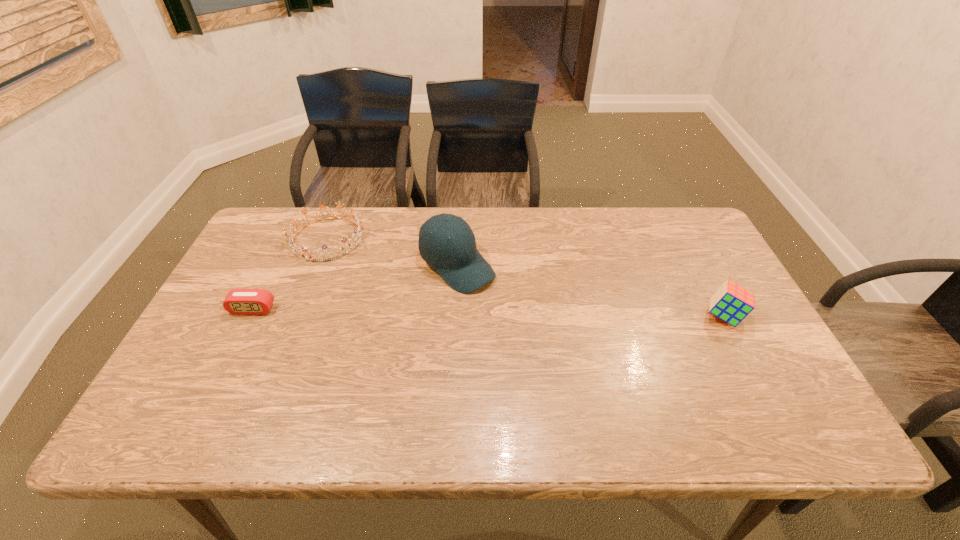
At what (x,y) coordinates should I click in order to perform the action: click on the shortest object. Please return your answer as a coordinate pair (x, y). The height and width of the screenshot is (540, 960). Looking at the image, I should click on (238, 301).

Identify the location of the third shortest object. (732, 303).

Locate an element on the screen. The image size is (960, 540). the rightmost object is located at coordinates [x=732, y=303].

I want to click on the third tallest object, so click(359, 235).

Find the location of `the tallest object`. the tallest object is located at coordinates (457, 260).

At what (x,y) coordinates should I click in order to perform the action: click on the third object from left to right. Please return your answer as a coordinate pair (x, y). The image size is (960, 540). Looking at the image, I should click on (457, 260).

This screenshot has height=540, width=960. I want to click on blank space located on the front-facing side of the alarm clock, so click(213, 388).

I want to click on vacant space located 0.310m on the back of the third shortest object, so click(x=680, y=231).

Locate an element on the screen. vacant region located on the front-facing side of the second shortest object is located at coordinates (410, 304).

The height and width of the screenshot is (540, 960). In order to click on blank space located on the front-facing side of the second shortest object in this screenshot , I will do `click(362, 266)`.